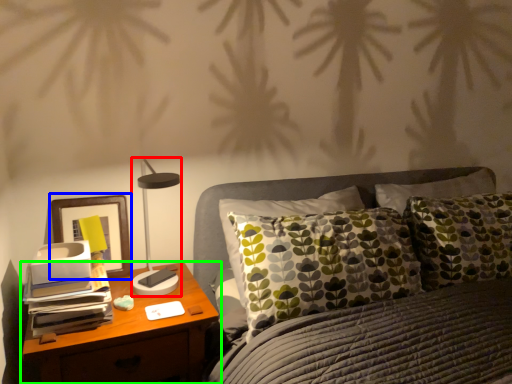
Question: Which object is the closest to the table lamp (highlighted by a red box)? Choose among these: picture frame (highlighted by a blue box) or nightstand (highlighted by a green box).

Choices:
 (A) picture frame
 (B) nightstand

Answer: (A)